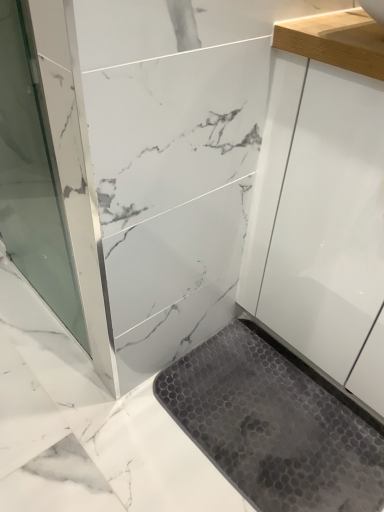
Question: Is gray hexagonal rubber mat at lower center with transparent glass screen door at left?

Choices:
 (A) no
 (B) yes

Answer: (A)

Question: Is gray hexagonal rubber mat at lower center to the left of transparent glass screen door at left from the viewer's perspective?

Choices:
 (A) no
 (B) yes

Answer: (A)

Question: From the image's perspective, is gray hexagonal rubber mat at lower center over transparent glass screen door at left?

Choices:
 (A) no
 (B) yes

Answer: (A)

Question: Is gray hexagonal rubber mat at lower center facing towards transparent glass screen door at left?

Choices:
 (A) yes
 (B) no

Answer: (B)

Question: Could transparent glass screen door at left be considered to be inside gray hexagonal rubber mat at lower center?

Choices:
 (A) no
 (B) yes

Answer: (A)

Question: Considering the relative sizes of gray hexagonal rubber mat at lower center and transparent glass screen door at left in the image provided, is gray hexagonal rubber mat at lower center bigger than transparent glass screen door at left?

Choices:
 (A) yes
 (B) no

Answer: (B)

Question: Is transparent glass screen door at left turned away from gray hexagonal rubber mat at lower center?

Choices:
 (A) yes
 (B) no

Answer: (B)

Question: Is transparent glass screen door at left directly adjacent to gray hexagonal rubber mat at lower center?

Choices:
 (A) no
 (B) yes

Answer: (A)

Question: Is transparent glass screen door at left far away from gray hexagonal rubber mat at lower center?

Choices:
 (A) no
 (B) yes

Answer: (A)

Question: Is gray hexagonal rubber mat at lower center surrounded by transparent glass screen door at left?

Choices:
 (A) yes
 (B) no

Answer: (B)

Question: Does transparent glass screen door at left have a lesser width compared to gray hexagonal rubber mat at lower center?

Choices:
 (A) no
 (B) yes

Answer: (B)

Question: From the image's perspective, is transparent glass screen door at left located above gray hexagonal rubber mat at lower center?

Choices:
 (A) no
 (B) yes

Answer: (B)

Question: From the image's perspective, is gray hexagonal rubber mat at lower center located above or below transparent glass screen door at left?

Choices:
 (A) below
 (B) above

Answer: (A)